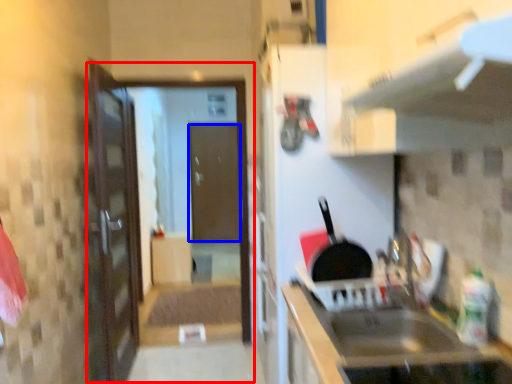
Question: Which object is closer to the camera taking this photo, screen door (highlighted by a red box) or door (highlighted by a blue box)?

Choices:
 (A) screen door
 (B) door

Answer: (A)